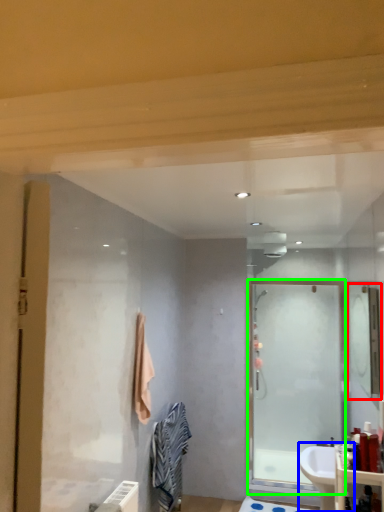
Question: Which object is the farthest from mirror (highlighted by a red box)? Choose among these: sink (highlighted by a blue box) or screen door (highlighted by a green box).

Choices:
 (A) sink
 (B) screen door

Answer: (A)